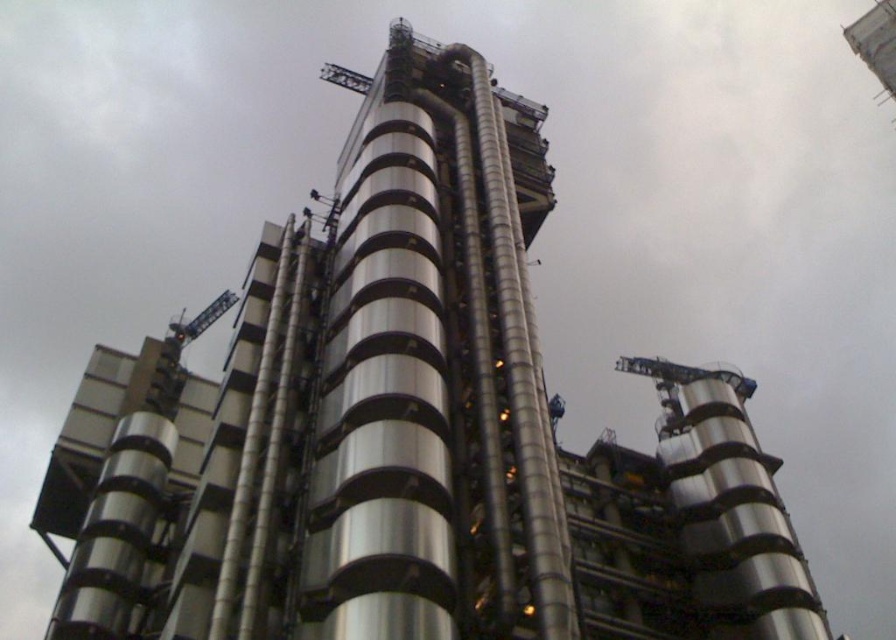
Between metallic silver tower at center and metallic gray crane at upper left, which one appears on the right side from the viewer's perspective?

From the viewer's perspective, metallic silver tower at center appears more on the right side.

Can you confirm if metallic silver tower at center is positioned above metallic gray crane at upper left?

Indeed, metallic silver tower at center is positioned over metallic gray crane at upper left.

This screenshot has width=896, height=640. Describe the element at coordinates (431, 380) in the screenshot. I see `metallic silver tower at center` at that location.

Identify the location of metallic silver tower at center. (431, 380).